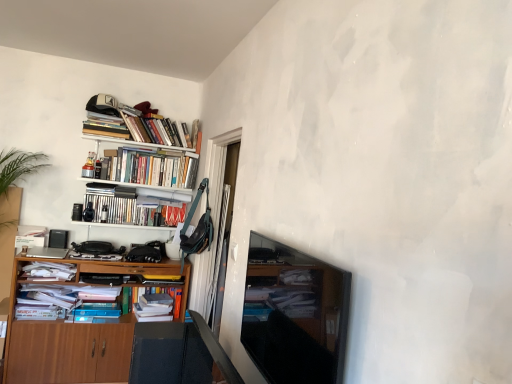
At what (x,y) coordinates should I click in order to perform the action: click on empty space that is ontop of hardcover books at upper left, which is the 2th book from bottom to top (from a real-world perspective). Please return your answer as a coordinate pair (x, y). Image resolution: width=512 pixels, height=384 pixels. Looking at the image, I should click on (137, 199).